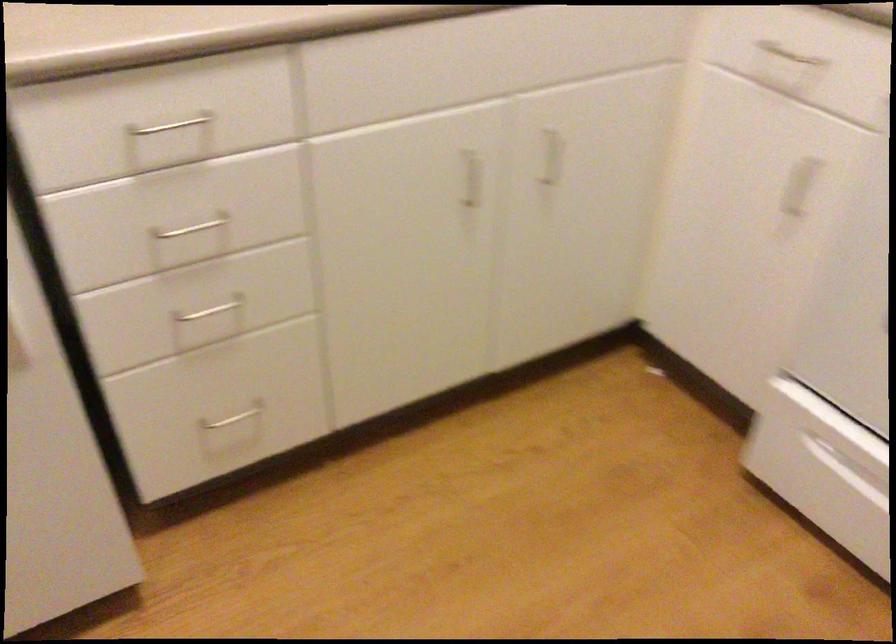
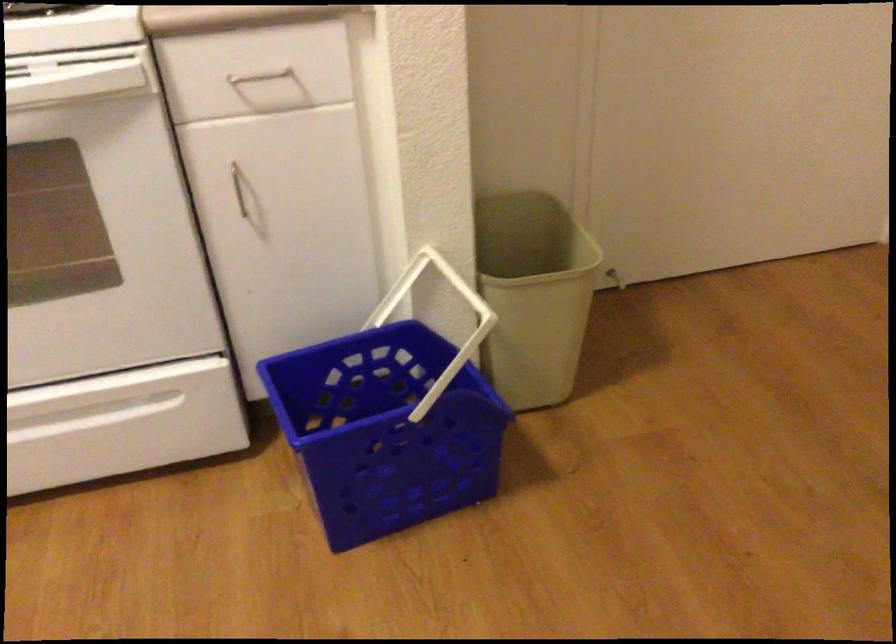
The first image is from the beginning of the video and the second image is from the end. How did the camera likely rotate when shooting the video?

The camera's rotation is toward right-down.